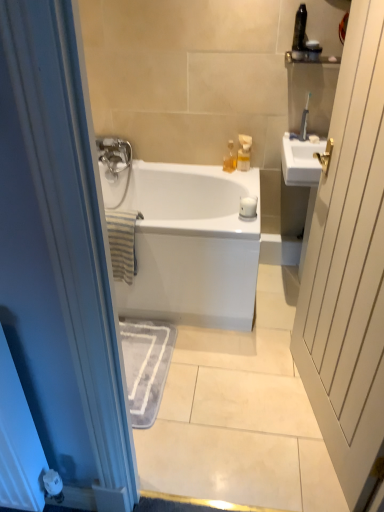
Question: Should I look upward or downward to see black plastic toothbrush at upper right, arranged as the 3th toiletry when viewed from the right?

Choices:
 (A) down
 (B) up

Answer: (B)

Question: Considering the relative positions of translucent plastic soap dispenser at upper center, which ranks as the 4th toiletry in right-to-left order, and black plastic toothbrush at upper right, the 3th toiletry in the left-to-right sequence, in the image provided, is translucent plastic soap dispenser at upper center, which ranks as the 4th toiletry in right-to-left order, to the left of black plastic toothbrush at upper right, the 3th toiletry in the left-to-right sequence, from the viewer's perspective?

Choices:
 (A) no
 (B) yes

Answer: (B)

Question: Would you say translucent plastic soap dispenser at upper center, which ranks as the 4th toiletry in right-to-left order, is a long distance from black plastic toothbrush at upper right, arranged as the 3th toiletry when viewed from the right?

Choices:
 (A) no
 (B) yes

Answer: (A)

Question: Can you confirm if translucent plastic soap dispenser at upper center, acting as the second toiletry starting from the left, is taller than black plastic toothbrush at upper right, arranged as the 3th toiletry when viewed from the right?

Choices:
 (A) no
 (B) yes

Answer: (A)

Question: Can you confirm if translucent plastic soap dispenser at upper center, acting as the second toiletry starting from the left, is wider than black plastic toothbrush at upper right, arranged as the 3th toiletry when viewed from the right?

Choices:
 (A) yes
 (B) no

Answer: (B)

Question: Is translucent plastic soap dispenser at upper center, which ranks as the 4th toiletry in right-to-left order, in front of black plastic toothbrush at upper right, arranged as the 3th toiletry when viewed from the right?

Choices:
 (A) no
 (B) yes

Answer: (A)

Question: Considering the relative sizes of translucent plastic soap dispenser at upper center, which ranks as the 4th toiletry in right-to-left order, and black plastic toothbrush at upper right, arranged as the 3th toiletry when viewed from the right, in the image provided, is translucent plastic soap dispenser at upper center, which ranks as the 4th toiletry in right-to-left order, shorter than black plastic toothbrush at upper right, arranged as the 3th toiletry when viewed from the right,?

Choices:
 (A) yes
 (B) no

Answer: (A)

Question: Would you say translucent plastic container at upper right, arranged as the fourth toiletry when viewed from the left, contains black plastic toothbrush at upper right, arranged as the 3th toiletry when viewed from the right?

Choices:
 (A) no
 (B) yes

Answer: (A)

Question: Is translucent plastic container at upper right, which appears as the 2th toiletry when viewed from the right, oriented towards black plastic toothbrush at upper right, the 3th toiletry in the left-to-right sequence?

Choices:
 (A) no
 (B) yes

Answer: (A)

Question: Is translucent plastic container at upper right, arranged as the fourth toiletry when viewed from the left, facing away from black plastic toothbrush at upper right, the 3th toiletry in the left-to-right sequence?

Choices:
 (A) no
 (B) yes

Answer: (A)

Question: Can you confirm if translucent plastic container at upper right, arranged as the fourth toiletry when viewed from the left, is shorter than black plastic toothbrush at upper right, arranged as the 3th toiletry when viewed from the right?

Choices:
 (A) yes
 (B) no

Answer: (A)

Question: Is translucent plastic container at upper right, which appears as the 2th toiletry when viewed from the right, directly adjacent to black plastic toothbrush at upper right, the 3th toiletry in the left-to-right sequence?

Choices:
 (A) no
 (B) yes

Answer: (B)

Question: Are translucent plastic container at upper right, which appears as the 2th toiletry when viewed from the right, and black plastic toothbrush at upper right, arranged as the 3th toiletry when viewed from the right, far apart?

Choices:
 (A) no
 (B) yes

Answer: (A)

Question: Does white wood door at right have a greater height compared to translucent plastic container at upper right, which appears as the 2th toiletry when viewed from the right?

Choices:
 (A) yes
 (B) no

Answer: (A)